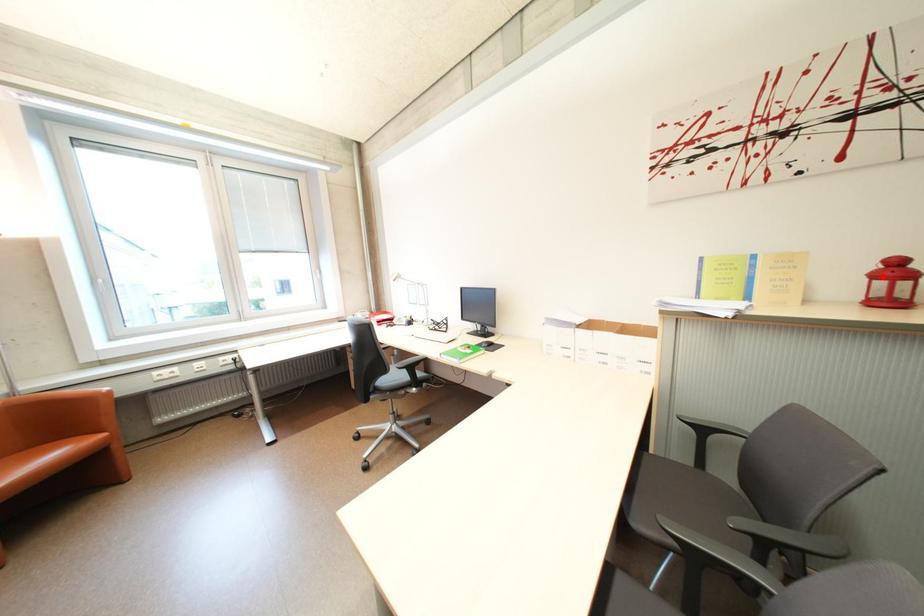
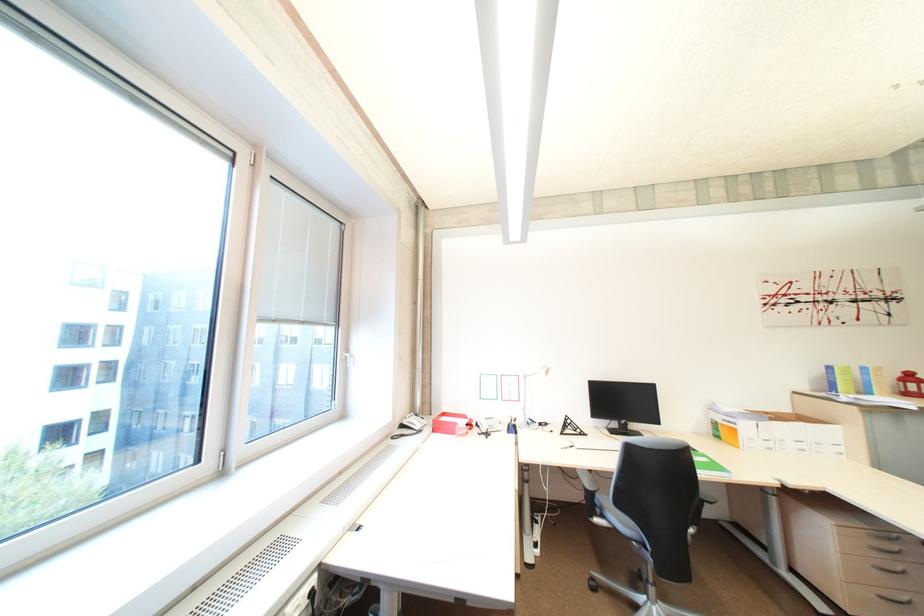
Where in the second image is the point corresponding to the highlighted location from the first image?

(913, 382)